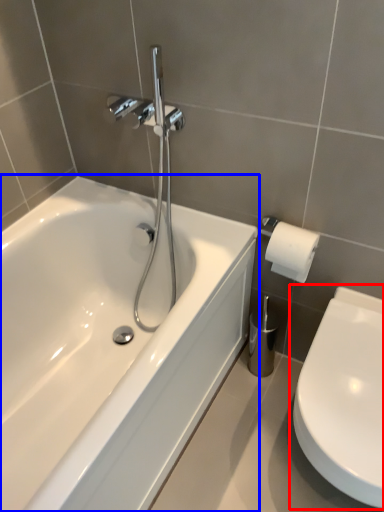
Question: Which object appears farthest to the camera in this image, toilet (highlighted by a red box) or bathtub (highlighted by a blue box)?

Choices:
 (A) toilet
 (B) bathtub

Answer: (A)